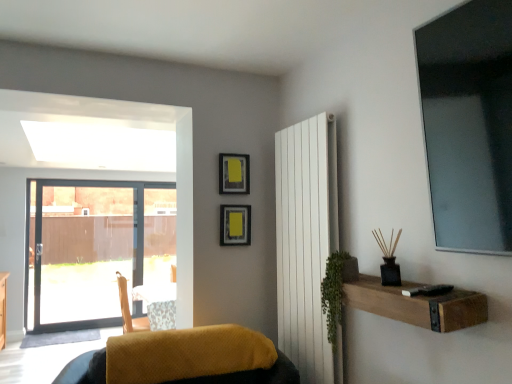
Question: Is white smooth radiator at center-right positioned with its back to velvet yellow cushion at lower center?

Choices:
 (A) yes
 (B) no

Answer: (B)

Question: Can you confirm if white smooth radiator at center-right is taller than velvet yellow cushion at lower center?

Choices:
 (A) yes
 (B) no

Answer: (A)

Question: Considering the relative sizes of white smooth radiator at center-right and velvet yellow cushion at lower center in the image provided, is white smooth radiator at center-right bigger than velvet yellow cushion at lower center?

Choices:
 (A) no
 (B) yes

Answer: (A)

Question: From a real-world perspective, is white smooth radiator at center-right below velvet yellow cushion at lower center?

Choices:
 (A) yes
 (B) no

Answer: (B)

Question: Is white smooth radiator at center-right touching velvet yellow cushion at lower center?

Choices:
 (A) no
 (B) yes

Answer: (A)

Question: Considering the positions of velvet yellow cushion at lower center and white smooth radiator at center-right in the image, is velvet yellow cushion at lower center taller or shorter than white smooth radiator at center-right?

Choices:
 (A) tall
 (B) short

Answer: (B)

Question: Does point (285, 360) appear closer or farther from the camera than point (286, 283)?

Choices:
 (A) farther
 (B) closer

Answer: (B)

Question: Looking at the image, does velvet yellow cushion at lower center seem bigger or smaller compared to white smooth radiator at center-right?

Choices:
 (A) small
 (B) big

Answer: (B)

Question: Is velvet yellow cushion at lower center situated inside white smooth radiator at center-right or outside?

Choices:
 (A) inside
 (B) outside

Answer: (B)

Question: From a real-world perspective, is brown wooden shelf at lower right positioned above or below white smooth radiator at center-right?

Choices:
 (A) below
 (B) above

Answer: (A)

Question: From the image's perspective, relative to white smooth radiator at center-right, is brown wooden shelf at lower right above or below?

Choices:
 (A) above
 (B) below

Answer: (B)

Question: Is brown wooden shelf at lower right in front of or behind white smooth radiator at center-right in the image?

Choices:
 (A) front
 (B) behind

Answer: (A)

Question: Is brown wooden shelf at lower right to the left or to the right of white smooth radiator at center-right in the image?

Choices:
 (A) left
 (B) right

Answer: (B)

Question: From the image's perspective, is white smooth radiator at center-right above or below green leafy plant at right?

Choices:
 (A) below
 (B) above

Answer: (B)

Question: Is point (308, 172) closer or farther from the camera than point (337, 263)?

Choices:
 (A) farther
 (B) closer

Answer: (A)